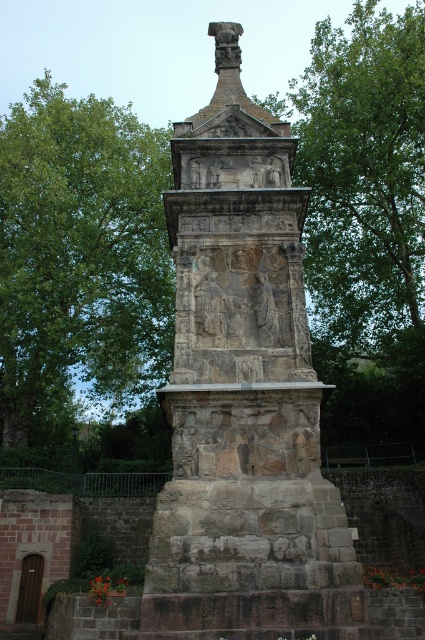
Can you confirm if green leafy tree at upper left is wider than green leafy tree at upper center?

Correct, the width of green leafy tree at upper left exceeds that of green leafy tree at upper center.

From the picture: Is green leafy tree at upper left bigger than green leafy tree at upper center?

Yes, green leafy tree at upper left is bigger than green leafy tree at upper center.

Describe the element at coordinates (79, 260) in the screenshot. I see `green leafy tree at upper left` at that location.

Where is `green leafy tree at upper left`? Image resolution: width=425 pixels, height=640 pixels. green leafy tree at upper left is located at coordinates (79, 260).

Who is shorter, stone sculpture at center or stone relief figures at center?

Standing shorter between the two is stone relief figures at center.

Which is behind, point (195, 275) or point (255, 289)?

Point (195, 275)

You are a GUI agent. You are given a task and a screenshot of the screen. Output one action in this format:
    pyautogui.click(x=<x>, y=<y>)
    Task: Click on the stone sculpture at center
    Image resolution: width=425 pixels, height=640 pixels.
    Given the screenshot: What is the action you would take?
    pyautogui.click(x=243, y=388)

Which of these two, green leafy tree at upper left or stone relief carving at center, stands shorter?

stone relief carving at center is shorter.

How much distance is there between green leafy tree at upper left and stone relief carving at center?

green leafy tree at upper left and stone relief carving at center are 45.91 meters apart.

Where is `green leafy tree at upper left`? The image size is (425, 640). green leafy tree at upper left is located at coordinates (79, 260).